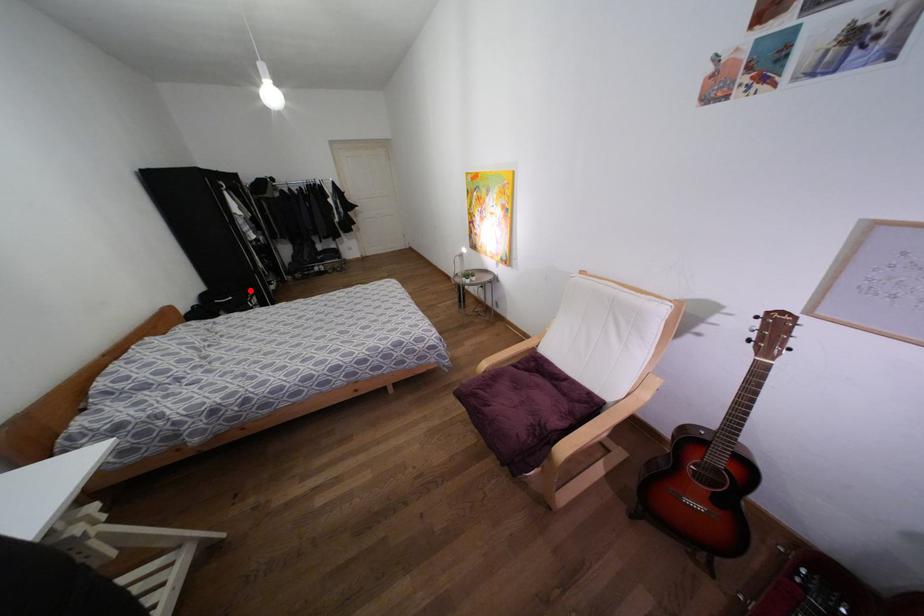
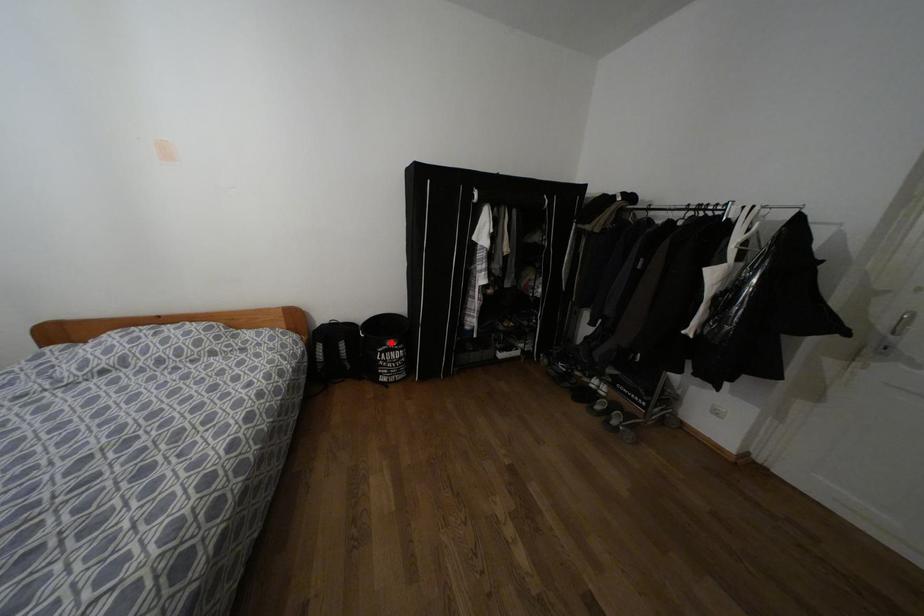
I am providing you with two images of the same scene from different viewpoints. A red point is marked on the first image and another point is marked on the second image. Does the point marked in image1 correspond to the same location as the one in image2?

Yes